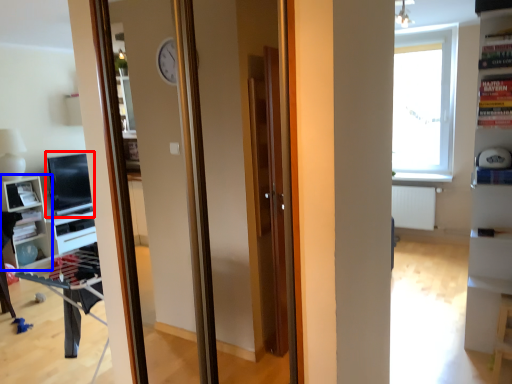
Question: Which point is closer to the camera, computer monitor (highlighted by a red box) or shelf (highlighted by a blue box)?

Choices:
 (A) computer monitor
 (B) shelf

Answer: (B)